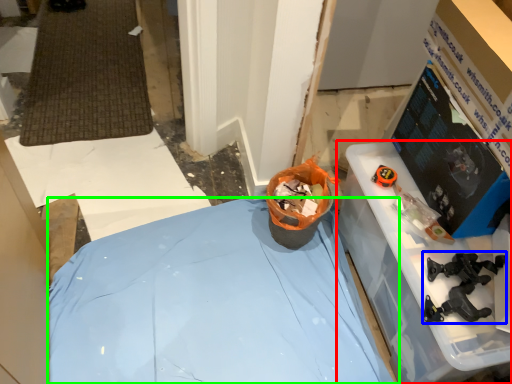
Question: Which is nearer to the furniture (highlighted by a red box)? tool (highlighted by a blue box) or furniture (highlighted by a green box).

Choices:
 (A) tool
 (B) furniture

Answer: (A)